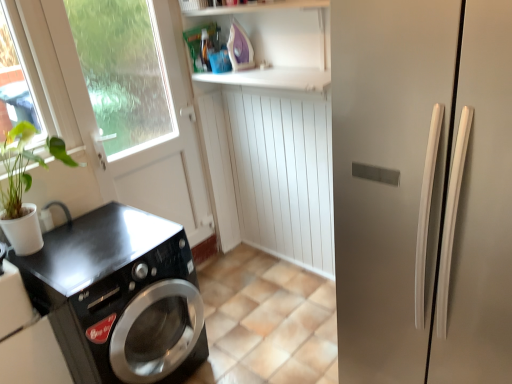
Question: From the image's perspective, would you say purple plastic iron at upper center is positioned over satin silver refrigerator at right?

Choices:
 (A) no
 (B) yes

Answer: (B)

Question: Can you confirm if purple plastic iron at upper center is positioned to the right of satin silver refrigerator at right?

Choices:
 (A) yes
 (B) no

Answer: (B)

Question: Could you tell me if purple plastic iron at upper center is turned towards satin silver refrigerator at right?

Choices:
 (A) yes
 (B) no

Answer: (B)

Question: From a real-world perspective, is purple plastic iron at upper center positioned under satin silver refrigerator at right based on gravity?

Choices:
 (A) yes
 (B) no

Answer: (B)

Question: From a real-world perspective, is purple plastic iron at upper center located higher than satin silver refrigerator at right?

Choices:
 (A) yes
 (B) no

Answer: (A)

Question: Is purple plastic iron at upper center behind satin silver refrigerator at right?

Choices:
 (A) no
 (B) yes

Answer: (B)

Question: Is satin silver refrigerator at right next to black glossy washing machine at lower left?

Choices:
 (A) yes
 (B) no

Answer: (B)

Question: Is satin silver refrigerator at right to the left of black glossy washing machine at lower left from the viewer's perspective?

Choices:
 (A) yes
 (B) no

Answer: (B)

Question: Does satin silver refrigerator at right have a greater height compared to black glossy washing machine at lower left?

Choices:
 (A) yes
 (B) no

Answer: (A)

Question: Considering the relative sizes of satin silver refrigerator at right and black glossy washing machine at lower left in the image provided, is satin silver refrigerator at right bigger than black glossy washing machine at lower left?

Choices:
 (A) no
 (B) yes

Answer: (B)

Question: Is black glossy washing machine at lower left a part of satin silver refrigerator at right?

Choices:
 (A) no
 (B) yes

Answer: (A)

Question: Is satin silver refrigerator at right further to the viewer compared to black glossy washing machine at lower left?

Choices:
 (A) yes
 (B) no

Answer: (B)

Question: Is the depth of purple plastic iron at upper center less than that of black glossy washing machine at lower left?

Choices:
 (A) yes
 (B) no

Answer: (B)